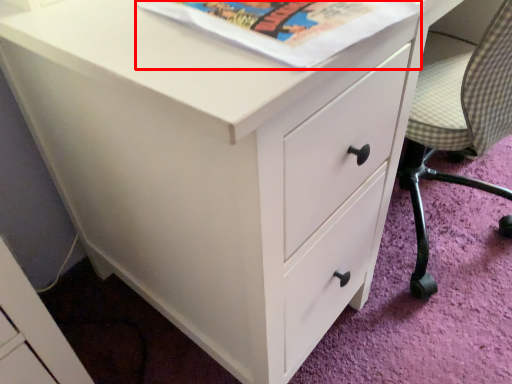
Question: Where is paperback book (annotated by the red box) located in relation to armchair in the image?

Choices:
 (A) left
 (B) right

Answer: (A)